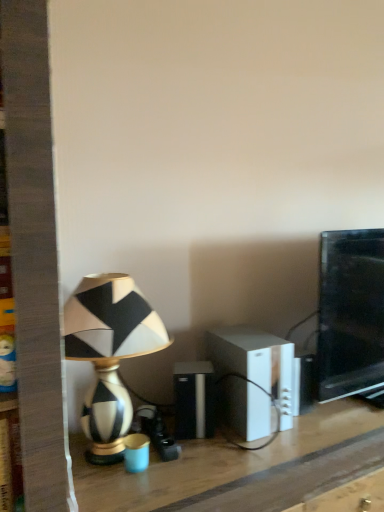
In order to click on free space to the right of black plastic speaker at center, the 2th speaker from the right in this screenshot , I will do `click(254, 445)`.